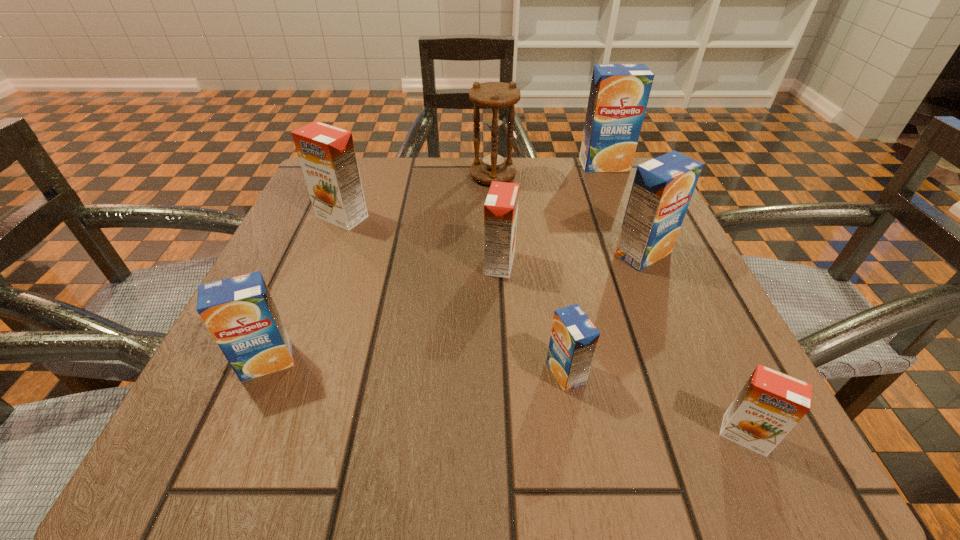
Image resolution: width=960 pixels, height=540 pixels. In order to click on free region that satisfies the following two spatial constraints: 1. on the front side of the sixth nearest object; 2. on the right side of the nearest orange orange juice in this screenshot , I will do `click(257, 435)`.

At what (x,y) coordinates should I click in order to perform the action: click on free space that satisfies the following two spatial constraints: 1. on the back side of the second smallest blue orange_juice; 2. on the right side of the second farthest blue orange_juice. Please return your answer as a coordinate pair (x, y). Looking at the image, I should click on (314, 254).

Locate an element on the screen. The image size is (960, 540). free spot that satisfies the following two spatial constraints: 1. on the front side of the second biggest blue orange_juice; 2. on the right side of the farthest blue orange_juice is located at coordinates (641, 254).

I want to click on vacant point that satisfies the following two spatial constraints: 1. on the back side of the second nearest orange orange juice; 2. on the right side of the leftmost blue orange_juice, so [309, 264].